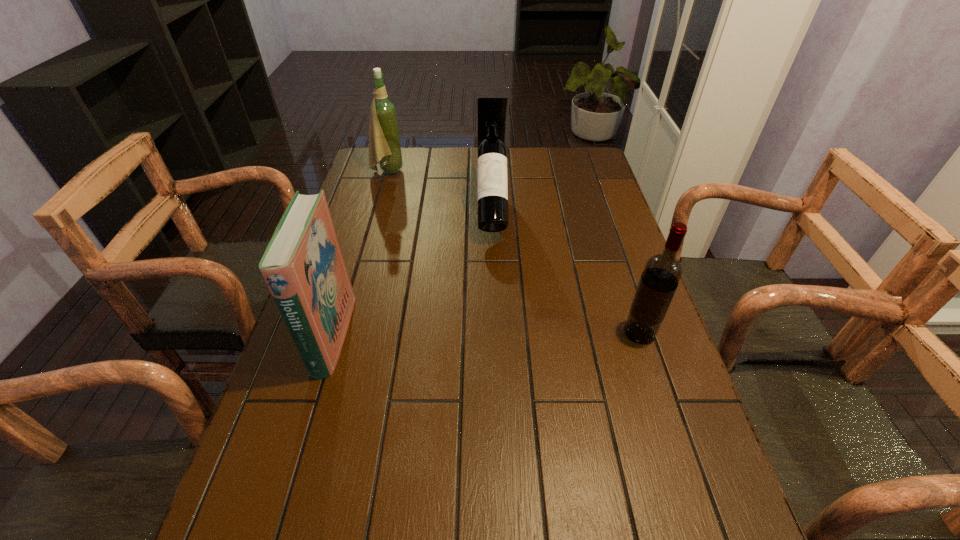
This screenshot has width=960, height=540. I want to click on the leftmost wine bottle, so click(384, 141).

Locate an element on the screen. the farthest wine bottle is located at coordinates (384, 141).

You are a GUI agent. You are given a task and a screenshot of the screen. Output one action in this format:
    pyautogui.click(x=<x>, y=<y>)
    Task: Click on the second wine bottle from right to left
    Image resolution: width=960 pixels, height=540 pixels.
    Given the screenshot: What is the action you would take?
    pyautogui.click(x=492, y=170)

Identify the location of the second nearest wine bottle. This screenshot has height=540, width=960. (492, 170).

The image size is (960, 540). What are the coordinates of `hardback book` in the screenshot? It's located at (303, 266).

You are a GUI agent. You are given a task and a screenshot of the screen. Output one action in this format:
    pyautogui.click(x=<x>, y=<y>)
    Task: Click on the rightmost object
    
    Given the screenshot: What is the action you would take?
    pyautogui.click(x=662, y=272)

The height and width of the screenshot is (540, 960). What are the coordinates of `the nearest wine bottle` in the screenshot? It's located at (662, 272).

The image size is (960, 540). What are the coordinates of `vacant space positioned 0.130m on the front-facing side of the farthest object` in the screenshot? It's located at (440, 171).

Identify the location of vacant region located 0.270m on the stand of the second farthest object. This screenshot has width=960, height=540. (495, 318).

You are a GUI agent. You are given a task and a screenshot of the screen. Output one action in this format:
    pyautogui.click(x=<x>, y=<y>)
    Task: Click on the vacant area located on the cover of the hardback book
    
    Given the screenshot: What is the action you would take?
    pyautogui.click(x=405, y=335)